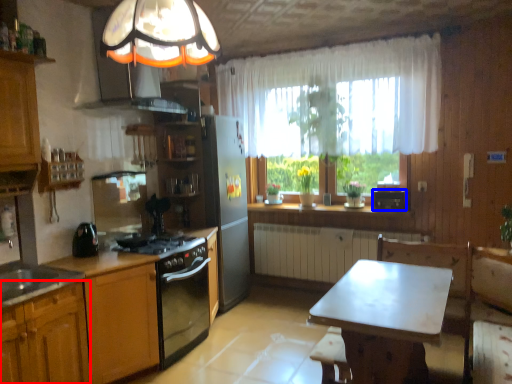
Question: Which point is further to the camera, cabinetry (highlighted by a red box) or appliance (highlighted by a blue box)?

Choices:
 (A) cabinetry
 (B) appliance

Answer: (B)